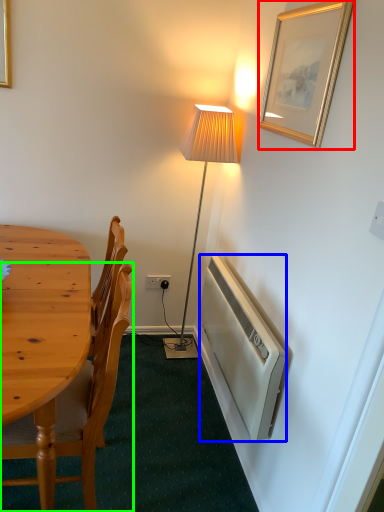
Question: Which object is positioned closest to picture frame (highlighted by a red box)? Select from radiator (highlighted by a blue box) and chair (highlighted by a green box).

Choices:
 (A) radiator
 (B) chair

Answer: (A)